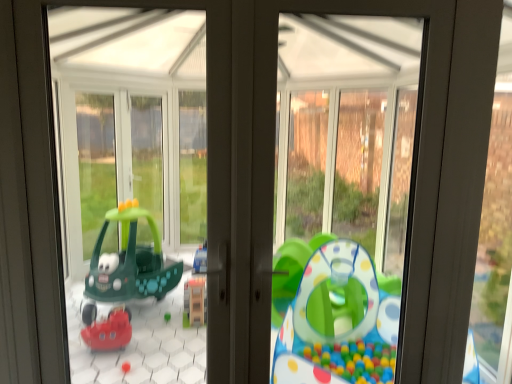
Question: Which is correct: matte gray window frame at right is inside green plastic toy boat at left, or outside of it?

Choices:
 (A) outside
 (B) inside

Answer: (A)

Question: Is matte gray window frame at right taller or shorter than green plastic toy boat at left?

Choices:
 (A) short
 (B) tall

Answer: (B)

Question: From a real-world perspective, relative to green plastic toy boat at left, is matte gray window frame at right vertically above or below?

Choices:
 (A) above
 (B) below

Answer: (B)

Question: Considering their positions, is green plastic toy boat at left located in front of or behind matte gray window frame at right?

Choices:
 (A) front
 (B) behind

Answer: (A)

Question: Would you say green plastic toy boat at left is inside or outside matte gray window frame at right?

Choices:
 (A) inside
 (B) outside

Answer: (B)

Question: Is point (204, 362) closer or farther from the camera than point (340, 114)?

Choices:
 (A) farther
 (B) closer

Answer: (B)

Question: In terms of height, does green plastic toy boat at left look taller or shorter compared to matte gray window frame at right?

Choices:
 (A) short
 (B) tall

Answer: (A)